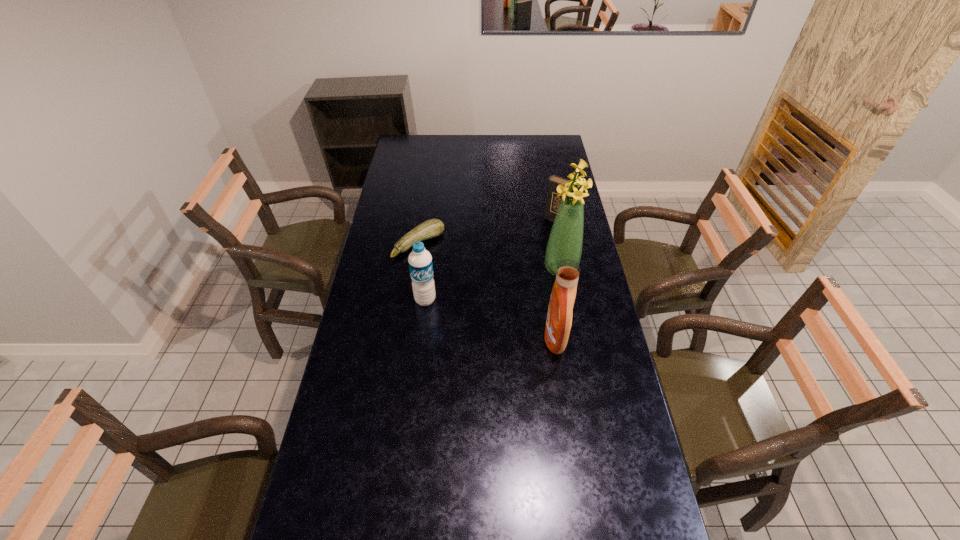
At what (x,y) coordinates should I click in order to perform the action: click on free space in the image that satisfies the following two spatial constraints: 1. on the label of the nearest object; 2. on the front-facing side of the fourth farthest object. Please return your answer as a coordinate pair (x, y). This screenshot has height=540, width=960. Looking at the image, I should click on (421, 338).

At what (x,y) coordinates should I click in order to perform the action: click on vacant area that satisfies the following two spatial constraints: 1. on the label of the second nearest object; 2. on the front-facing side of the nearest object. Please return your answer as a coordinate pair (x, y). The width and height of the screenshot is (960, 540). Looking at the image, I should click on (421, 338).